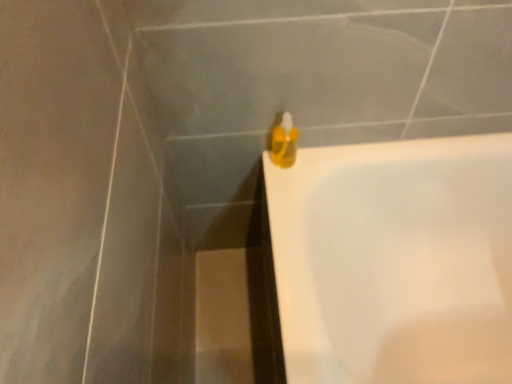
Question: Does translucent yellow liquid at upper right appear on the right side of white glossy bathtub at upper right?

Choices:
 (A) yes
 (B) no

Answer: (B)

Question: From a real-world perspective, is translucent yellow liquid at upper right below white glossy bathtub at upper right?

Choices:
 (A) yes
 (B) no

Answer: (B)

Question: From the image's perspective, would you say translucent yellow liquid at upper right is positioned over white glossy bathtub at upper right?

Choices:
 (A) yes
 (B) no

Answer: (A)

Question: Can you see translucent yellow liquid at upper right touching white glossy bathtub at upper right?

Choices:
 (A) yes
 (B) no

Answer: (B)

Question: Does translucent yellow liquid at upper right have a larger size compared to white glossy bathtub at upper right?

Choices:
 (A) yes
 (B) no

Answer: (B)

Question: Does translucent yellow liquid at upper right lie behind white glossy bathtub at upper right?

Choices:
 (A) no
 (B) yes

Answer: (B)

Question: Does white glossy bathtub at upper right come behind translucent yellow liquid at upper right?

Choices:
 (A) yes
 (B) no

Answer: (B)

Question: Would you say white glossy bathtub at upper right is a long distance from translucent yellow liquid at upper right?

Choices:
 (A) yes
 (B) no

Answer: (B)

Question: Is translucent yellow liquid at upper right inside white glossy bathtub at upper right?

Choices:
 (A) no
 (B) yes

Answer: (A)

Question: Is white glossy bathtub at upper right oriented towards translucent yellow liquid at upper right?

Choices:
 (A) no
 (B) yes

Answer: (A)

Question: Is white glossy bathtub at upper right smaller than translucent yellow liquid at upper right?

Choices:
 (A) no
 (B) yes

Answer: (A)

Question: Does white glossy bathtub at upper right appear on the right side of translucent yellow liquid at upper right?

Choices:
 (A) yes
 (B) no

Answer: (A)

Question: In terms of height, does translucent yellow liquid at upper right look taller or shorter compared to white glossy bathtub at upper right?

Choices:
 (A) short
 (B) tall

Answer: (A)